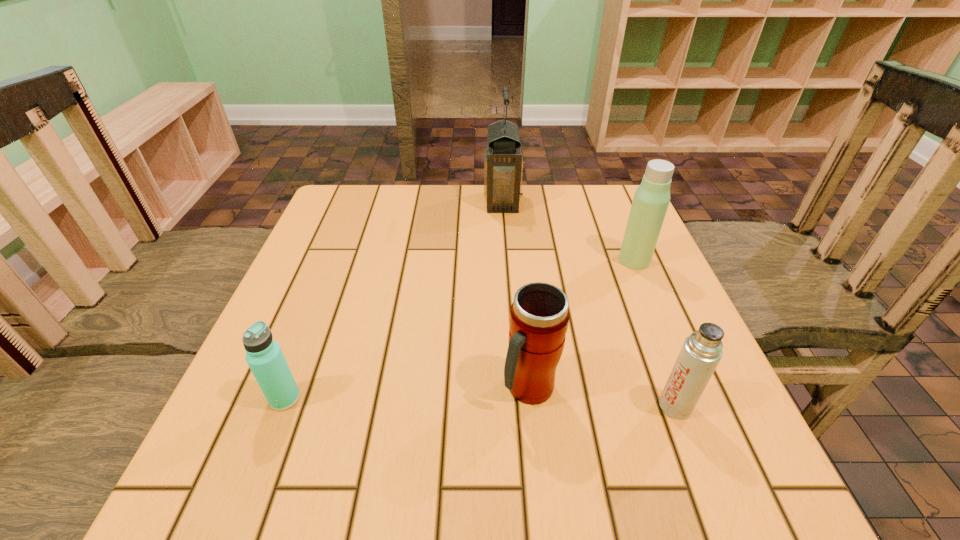
Identify which thermos bottle is the second nearest to the second thermos bottle from left to right. Please provide its 2D coordinates. Your answer should be formatted as a tuple, i.e. [(x, y)], where the tuple contains the x and y coordinates of a point satisfying the conditions above.

[(651, 199)]

This screenshot has height=540, width=960. I want to click on free space in the image that satisfies the following two spatial constraints: 1. on the front-facing side of the second farthest object; 2. on the right side of the lantern, so click(x=506, y=260).